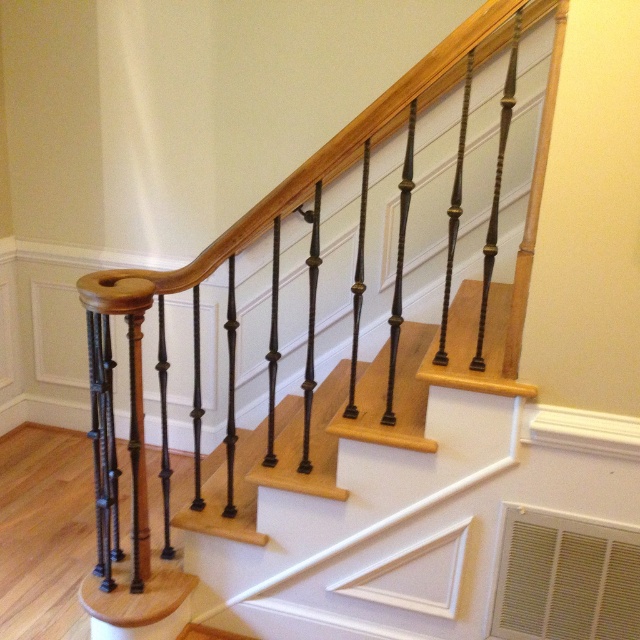
You are standing at the bottom of the staircase and want to grab the handrail. Which object, the black wrought iron railing at upper center or the polished wood stair at center, is higher up from the ground?

The black wrought iron railing at upper center is much taller than the polished wood stair at center, so it is higher up from the ground.

You are a painter holding a 15 cm wide paintbrush. You need to paint both the black wrought iron railing at upper center and the polished wood stair at center. Can you fit your paintbrush between them without touching either surface?

The distance between the black wrought iron railing at upper center and the polished wood stair at center is 16.37 centimeters. Since your paintbrush is 15 cm wide, it can fit between them as there is enough space. However, you must ensure precise placement to avoid touching either surface.

You are standing at the bottom of the staircase and want to grab the handrail while climbing the polished wood stair at center. Based on the image, where is the black wrought iron railing at upper center located in relation to the stair?

The black wrought iron railing at upper center is above the polished wood stair at center, so you can reach it by looking upward while climbing the stair.